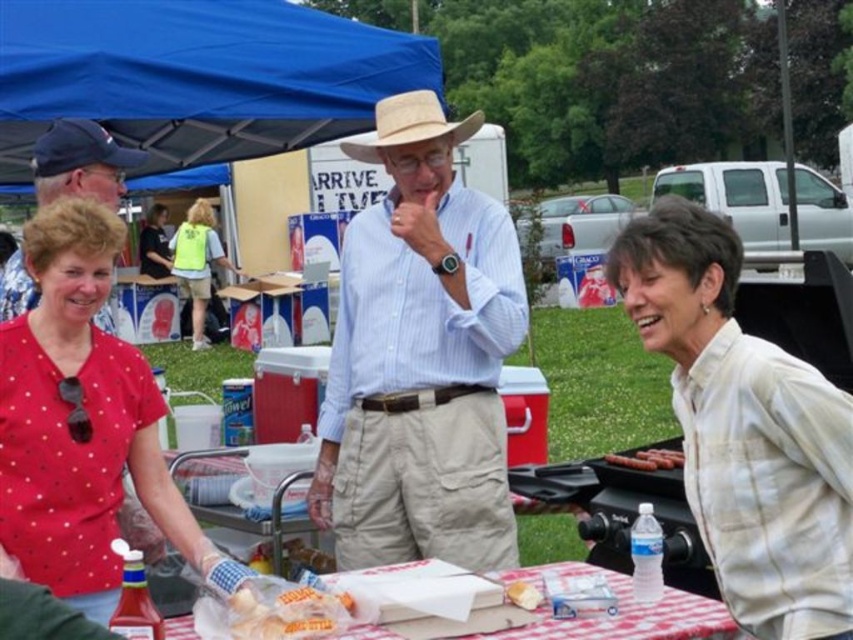
Question: Does red checkered tablecloth at lower center come behind matte blue cap at upper left?

Choices:
 (A) no
 (B) yes

Answer: (A)

Question: Can you confirm if natural straw cowboy hat at center is thinner than white bread at center?

Choices:
 (A) yes
 (B) no

Answer: (B)

Question: Does matte blue cap at upper left appear on the left side of reflective yellow vest at center?

Choices:
 (A) yes
 (B) no

Answer: (B)

Question: Which of the following is the closest to the observer?

Choices:
 (A) light blue striped shirt at center
 (B) red dotted shirt at center
 (C) white bread at center

Answer: (B)

Question: Which point is closer to the camera?

Choices:
 (A) light blue striped shirt at center
 (B) white bread at center

Answer: (B)

Question: Which is nearer to the natural straw cowboy hat at center?

Choices:
 (A) smooth brown hot dog at lower right
 (B) red dotted shirt at center
 (C) blue fabric canopy at upper left

Answer: (C)